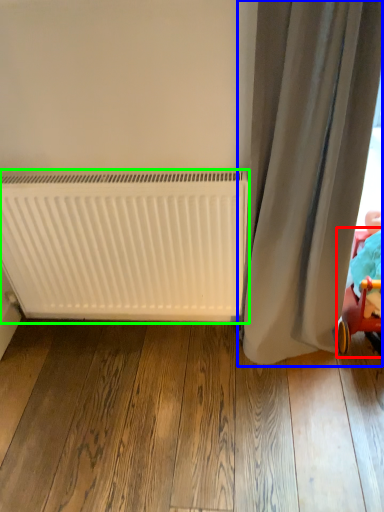
Question: Which is nearer to the baby carriage (highlighted by a red box)? curtain (highlighted by a blue box) or radiator (highlighted by a green box).

Choices:
 (A) curtain
 (B) radiator

Answer: (A)